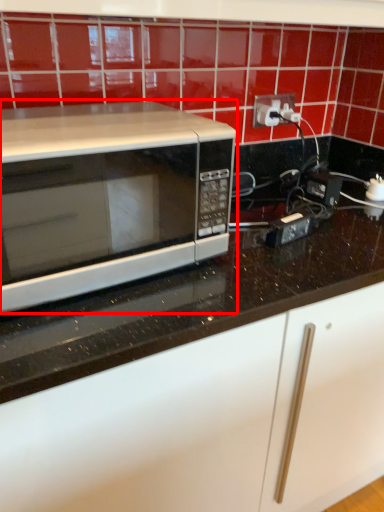
Question: In this image, where is microwave oven (annotated by the red box) located relative to electric outlet?

Choices:
 (A) left
 (B) right

Answer: (A)